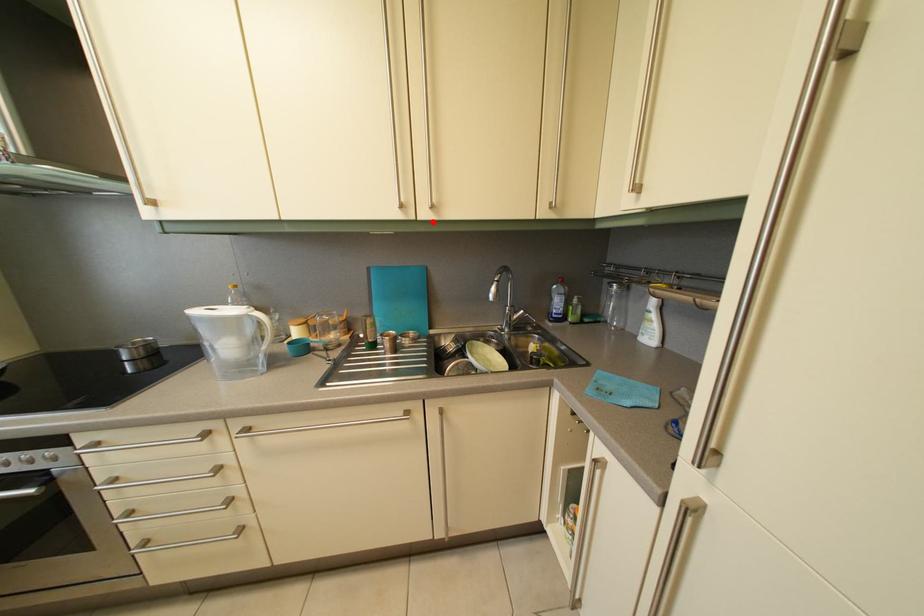
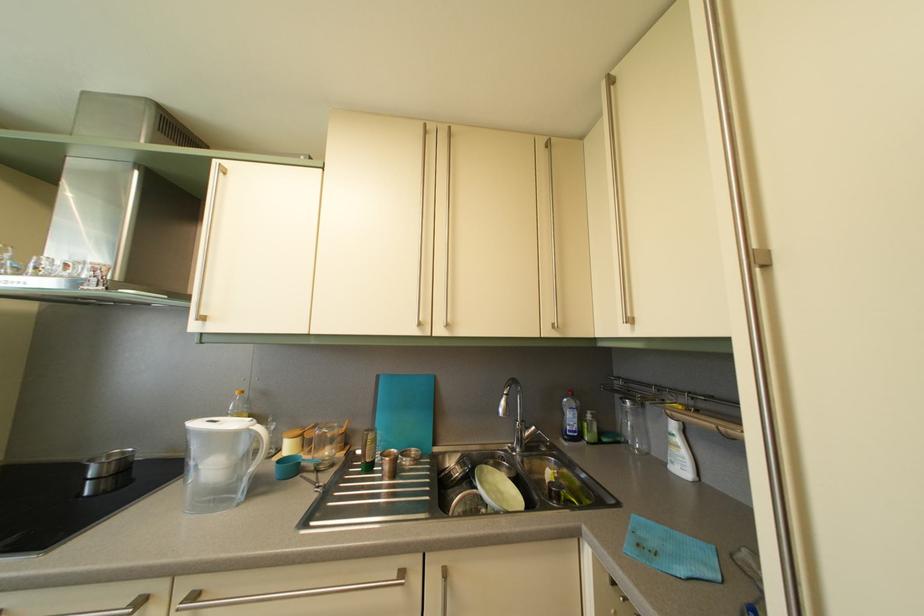
Find the pixel in the second image that matches the highlighted location in the first image.

(447, 339)